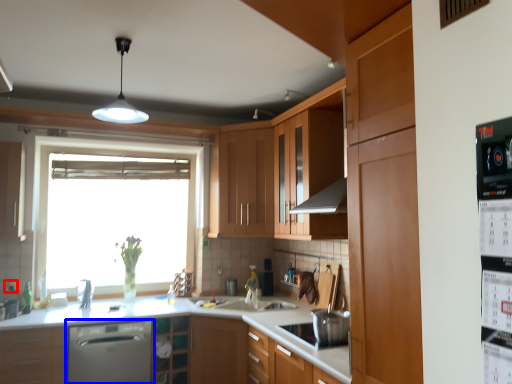
Question: Among these objects, which one is farthest to the camera, electric outlet (highlighted by a red box) or home appliance (highlighted by a blue box)?

Choices:
 (A) electric outlet
 (B) home appliance

Answer: (A)